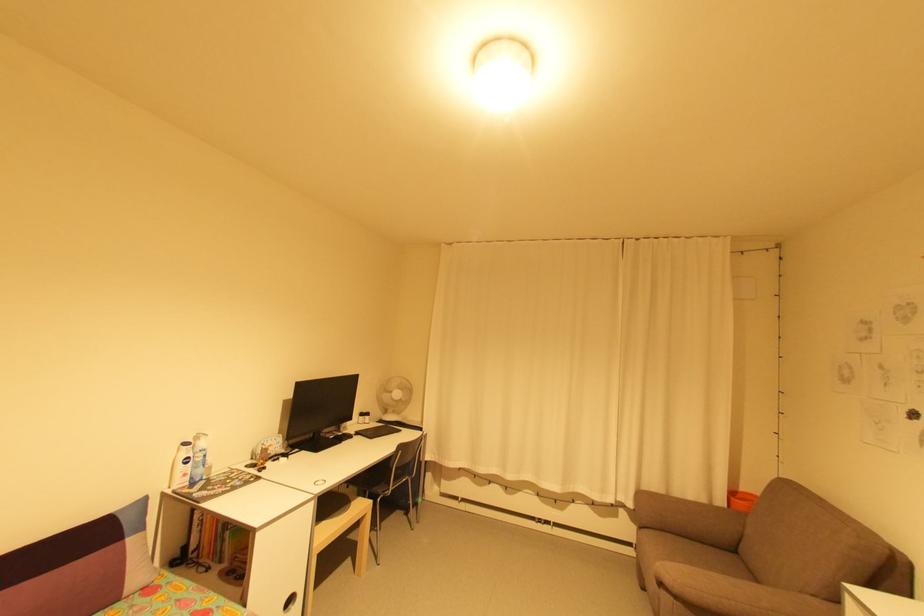
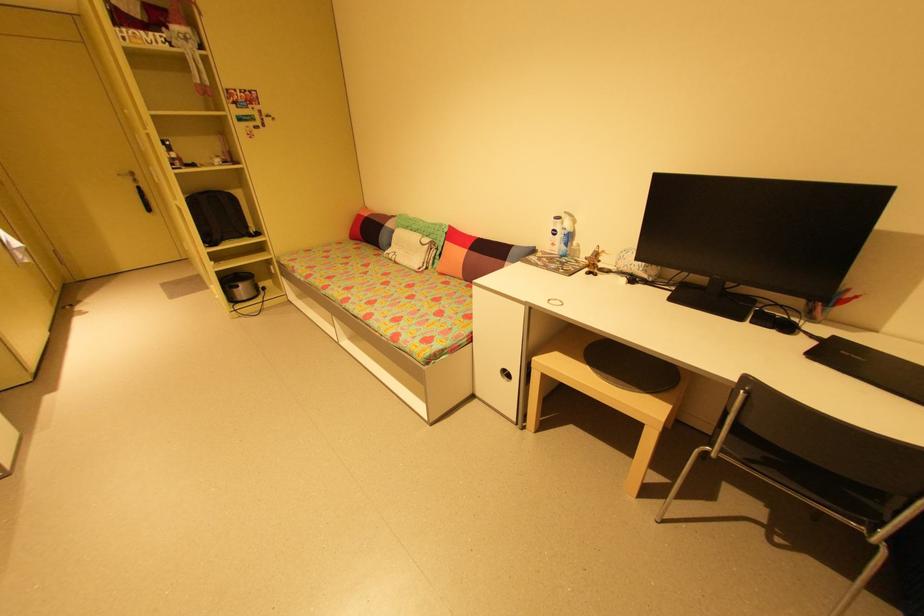
In the second image, find the point that corresponds to the point at 270,459 in the first image.

(597, 262)